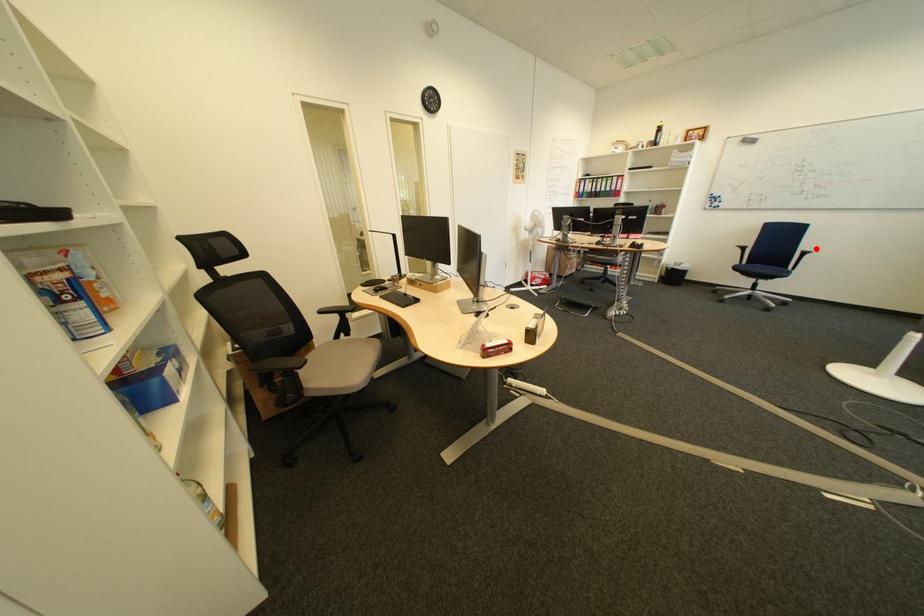
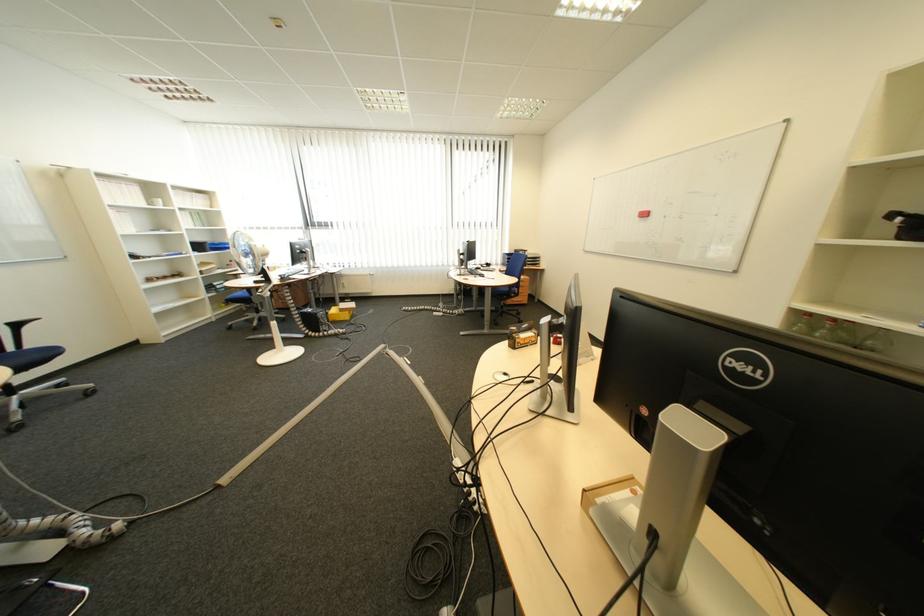
Question: I am providing you with two images of the same scene from different viewpoints. A red point is marked on the first image. At the location where the point appears in image 1, is it still visible in image 2?

Choices:
 (A) Yes
 (B) No

Answer: (A)